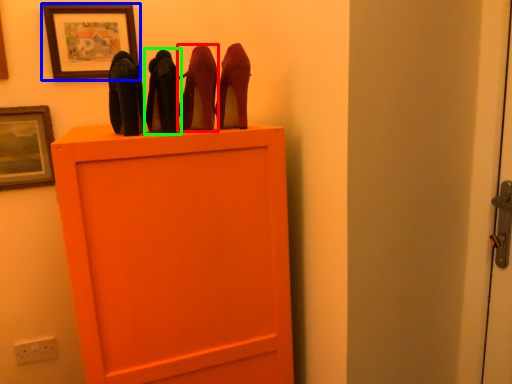
Question: Which object is positioned farthest from high heels (highlighted by a red box)? Select from picture frame (highlighted by a blue box) and high heels (highlighted by a green box).

Choices:
 (A) picture frame
 (B) high heels

Answer: (A)